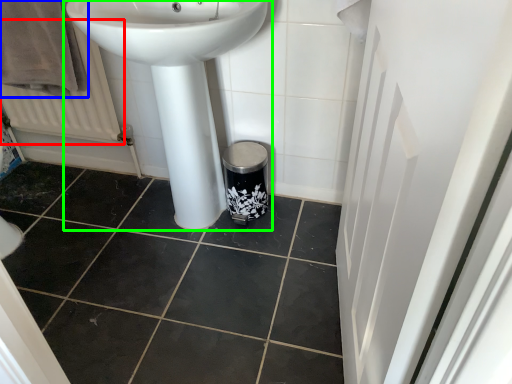
Question: Based on their relative distances, which object is farther from radiator (highlighted by a red box)? Choose from bath towel (highlighted by a blue box) and sink (highlighted by a green box).

Choices:
 (A) bath towel
 (B) sink

Answer: (B)